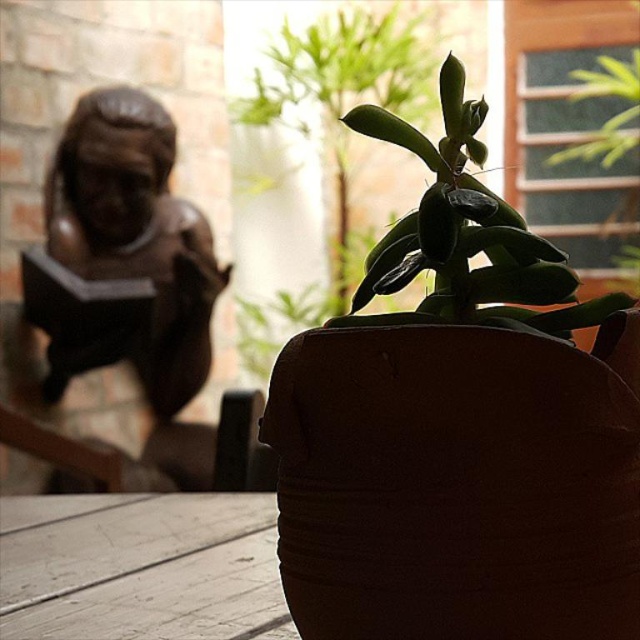
Question: Which point is closer to the camera?

Choices:
 (A) (250, 515)
 (B) (109, 230)

Answer: (A)

Question: Which point is closer to the camera taking this photo?

Choices:
 (A) (570, 300)
 (B) (157, 358)
 (C) (108, 536)

Answer: (A)

Question: Considering the relative positions of bronze statue at left and green matte succulent at center in the image provided, where is bronze statue at left located with respect to green matte succulent at center?

Choices:
 (A) below
 (B) above

Answer: (B)

Question: Can you confirm if bronze statue at left is smaller than green matte succulent at center?

Choices:
 (A) no
 (B) yes

Answer: (A)

Question: Does bronze statue at left appear on the right side of green matte succulent at center?

Choices:
 (A) yes
 (B) no

Answer: (B)

Question: Which point is farther to the camera?

Choices:
 (A) (60, 164)
 (B) (625, 300)
 (C) (13, 540)

Answer: (A)